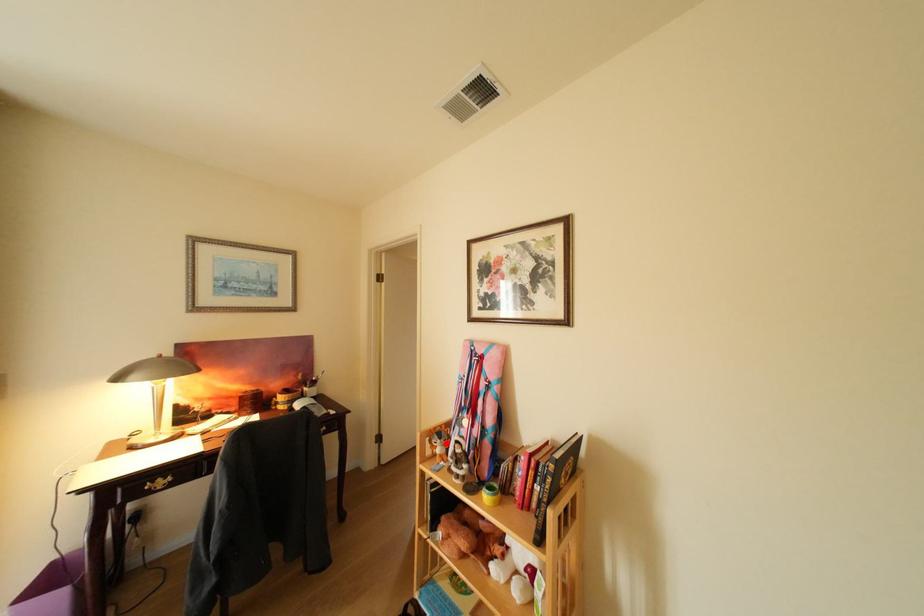
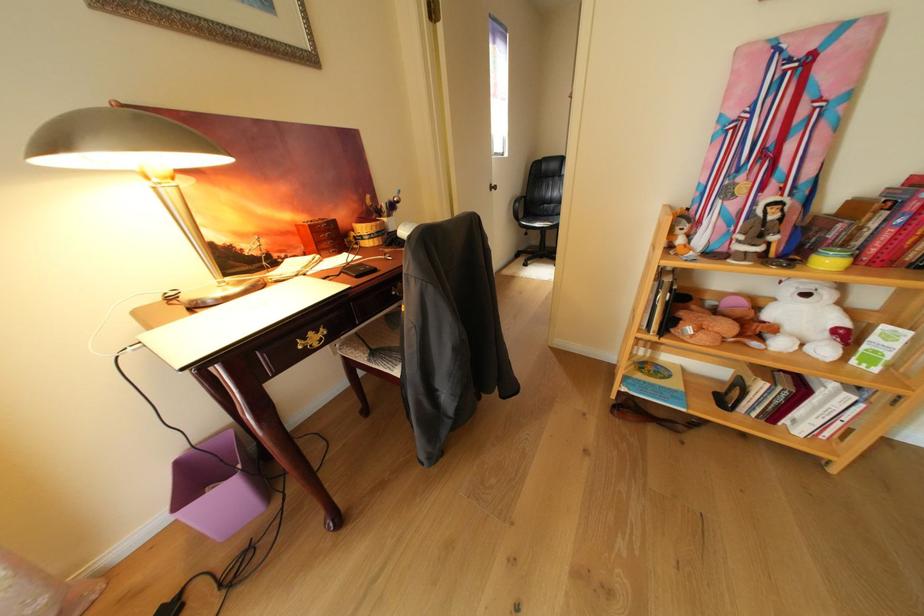
Where in the second image is the point corresponding to the highlighted location from the first image?

(689, 230)